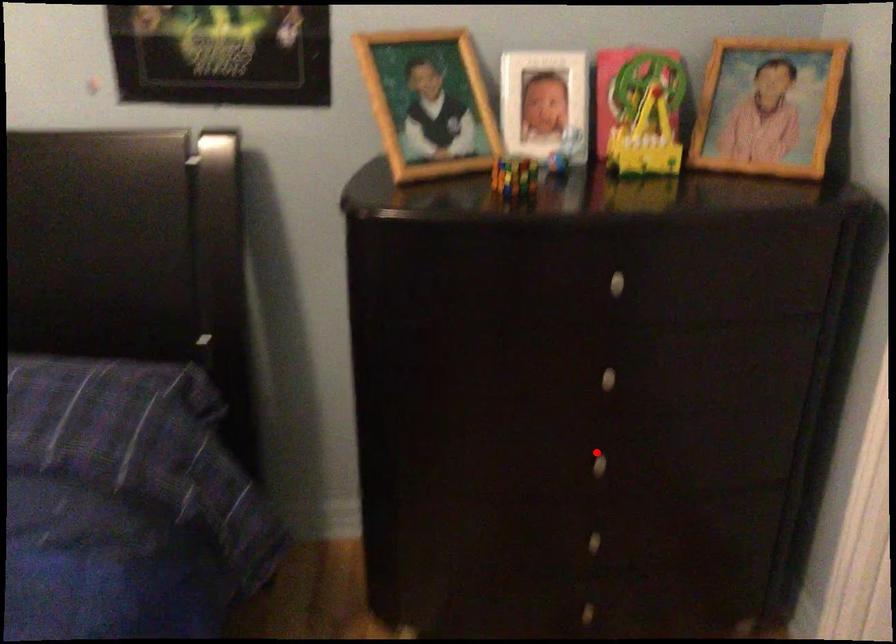
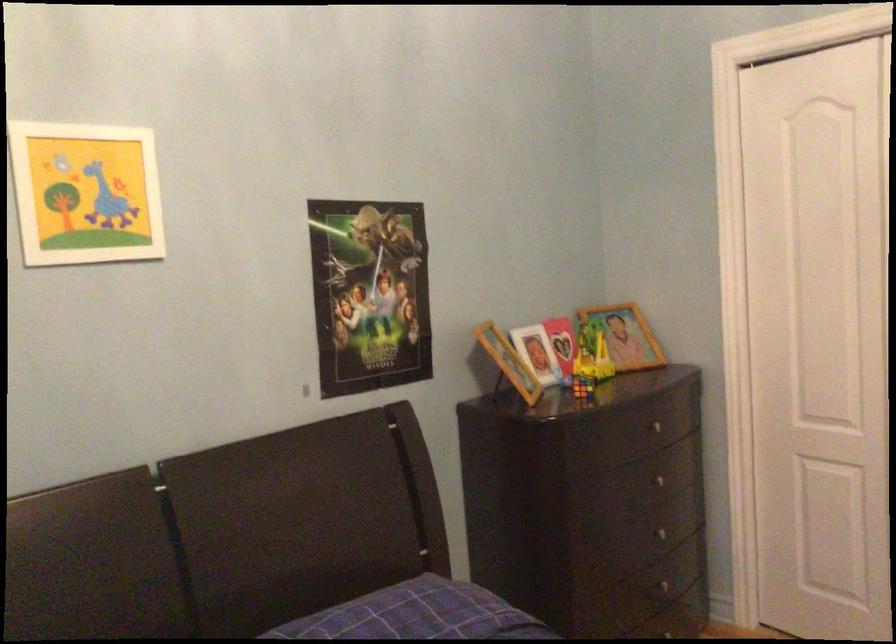
Find the pixel in the second image that matches the highlighted location in the first image.

(667, 532)